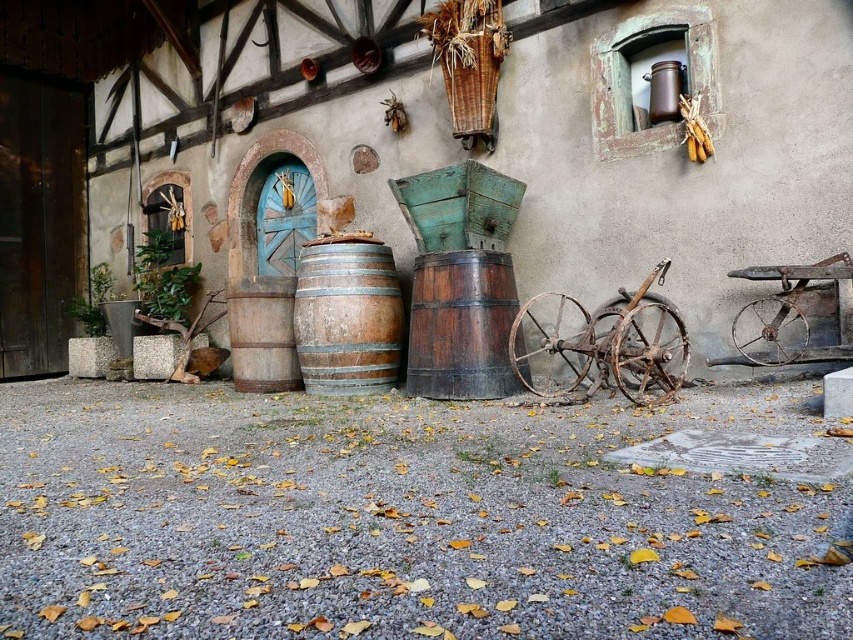
Question: Which is farther from the rusty metal wagon at right?

Choices:
 (A) rustic wooden barrel at center
 (B) dark brown wooden barrel at center

Answer: (A)

Question: Does rusty metal wagon at center have a larger size compared to dark brown wooden barrel at center?

Choices:
 (A) yes
 (B) no

Answer: (A)

Question: Which of the following is the farthest from the observer?

Choices:
 (A) [299, 253]
 (B) [671, 339]
 (C) [444, 316]
 (D) [793, 291]

Answer: (A)

Question: Is dark brown wooden barrel at center positioned at the back of rusty metal wagon at right?

Choices:
 (A) no
 (B) yes

Answer: (B)

Question: From the image, what is the correct spatial relationship of dark brown wooden barrel at center in relation to rusty metal wagon at right?

Choices:
 (A) left
 (B) right

Answer: (A)

Question: Based on their relative distances, which object is farther from the dark brown wooden barrel at center?

Choices:
 (A) rustic wooden barrel at center
 (B) rusty metal wagon at center

Answer: (A)